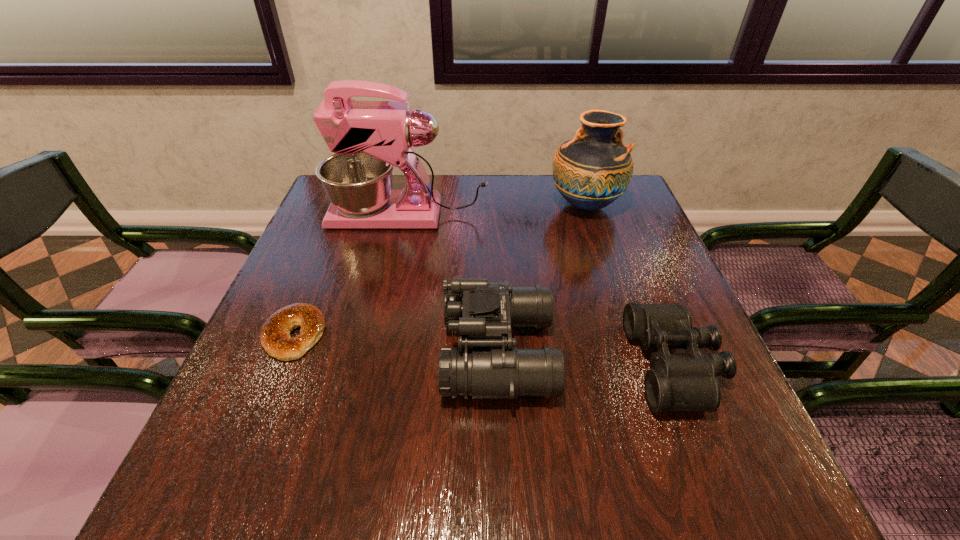
This screenshot has width=960, height=540. In order to click on vacant area situated through the lenses of the left binoculars in this screenshot , I will do `click(398, 353)`.

The height and width of the screenshot is (540, 960). Find the location of `free space located 0.080m at the eyepieces of the fourth tallest object`. free space located 0.080m at the eyepieces of the fourth tallest object is located at coordinates click(593, 365).

Locate an element on the screen. The width and height of the screenshot is (960, 540). vacant area situated at the eyepieces of the fourth tallest object is located at coordinates [x=541, y=365].

Identify the location of free space located 0.120m at the eyepieces of the fourth tallest object. (572, 365).

Locate an element on the screen. The image size is (960, 540). vacant point located on the front of the shortest object is located at coordinates tap(275, 385).

The image size is (960, 540). Identify the location of mixer located in the far edge section of the desktop. (368, 138).

The height and width of the screenshot is (540, 960). I want to click on pottery located at the far edge, so click(591, 171).

Identify the location of mixer at the left edge. (368, 138).

The image size is (960, 540). In order to click on bagel located at the left edge in this screenshot , I will do `click(275, 336)`.

Find the location of a particular element. Image resolution: width=960 pixels, height=540 pixels. pottery present at the right edge is located at coordinates (591, 171).